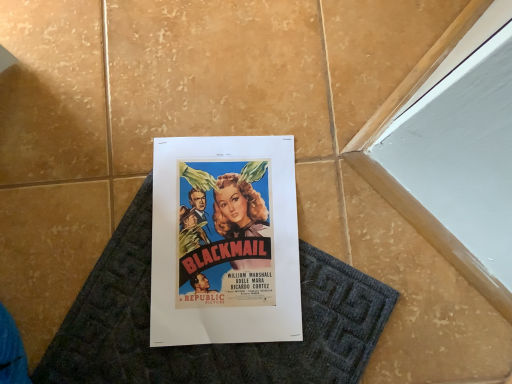
In order to face dark gray textured bath mat at center, should I rotate leftwards or rightwards?

A 1.414 degree turn to the left will do.

Describe the element at coordinates (210, 344) in the screenshot. I see `dark gray textured bath mat at center` at that location.

What are the coordinates of `dark gray textured bath mat at center` in the screenshot? It's located at (210, 344).

Identify the location of matte paper poster at center. This screenshot has width=512, height=384. (224, 241).

The image size is (512, 384). What do you see at coordinates (224, 241) in the screenshot?
I see `matte paper poster at center` at bounding box center [224, 241].

Where is `dark gray textured bath mat at center`? Image resolution: width=512 pixels, height=384 pixels. dark gray textured bath mat at center is located at coordinates (210, 344).

Considering the relative positions of matte paper poster at center and dark gray textured bath mat at center in the image provided, is matte paper poster at center to the left or to the right of dark gray textured bath mat at center?

matte paper poster at center is to the left of dark gray textured bath mat at center.

Is matte paper poster at center in front of dark gray textured bath mat at center?

No, it is not.

Which is in front, point (165, 170) or point (125, 380)?

The point (125, 380) is in front.

From the picture: From the image's perspective, would you say matte paper poster at center is shown under dark gray textured bath mat at center?

Actually, matte paper poster at center appears above dark gray textured bath mat at center in the image.

From a real-world perspective, is matte paper poster at center physically located above or below dark gray textured bath mat at center?

In terms of real-world spatial position, matte paper poster at center is above dark gray textured bath mat at center.

Between matte paper poster at center and dark gray textured bath mat at center, which one has larger width?

With larger width is matte paper poster at center.

Can you confirm if matte paper poster at center is shorter than dark gray textured bath mat at center?

No, matte paper poster at center is not shorter than dark gray textured bath mat at center.

Considering the sizes of matte paper poster at center and dark gray textured bath mat at center in the image, is matte paper poster at center bigger or smaller than dark gray textured bath mat at center?

Considering their sizes, matte paper poster at center takes up less space than dark gray textured bath mat at center.

Would you say matte paper poster at center is outside dark gray textured bath mat at center?

No.

Looking at this image, is matte paper poster at center placed right next to dark gray textured bath mat at center?

Yes, matte paper poster at center and dark gray textured bath mat at center clearly make contact.

Is matte paper poster at center facing towards dark gray textured bath mat at center?

Yes, matte paper poster at center is turned towards dark gray textured bath mat at center.

At what (x,y) coordinates should I click in order to perform the action: click on poster above the dark gray textured bath mat at center (from the image's perspective). Please return your answer as a coordinate pair (x, y). Image resolution: width=512 pixels, height=384 pixels. Looking at the image, I should click on (224, 241).

Which is more to the left, dark gray textured bath mat at center or matte paper poster at center?

matte paper poster at center is more to the left.

Which object is closer to the camera taking this photo, dark gray textured bath mat at center or matte paper poster at center?

dark gray textured bath mat at center is more forward.

Is point (54, 369) more distant than point (202, 207)?

No, (54, 369) is in front of (202, 207).

From the image's perspective, between dark gray textured bath mat at center and matte paper poster at center, who is located below?

dark gray textured bath mat at center, from the image's perspective.

From a real-world perspective, relative to matte paper poster at center, is dark gray textured bath mat at center vertically above or below?

Clearly, from a real-world perspective, dark gray textured bath mat at center is below matte paper poster at center.

Can you confirm if dark gray textured bath mat at center is thinner than matte paper poster at center?

Indeed, dark gray textured bath mat at center has a lesser width compared to matte paper poster at center.

Which of these two, dark gray textured bath mat at center or matte paper poster at center, stands shorter?

Standing shorter between the two is dark gray textured bath mat at center.

Which of these two, dark gray textured bath mat at center or matte paper poster at center, is bigger?

dark gray textured bath mat at center is bigger.

Is dark gray textured bath mat at center inside or outside of matte paper poster at center?

dark gray textured bath mat at center is enclosed within matte paper poster at center.

Consider the image. Are dark gray textured bath mat at center and matte paper poster at center making contact?

Yes, dark gray textured bath mat at center is touching matte paper poster at center.

Is matte paper poster at center at the back of dark gray textured bath mat at center?

Yes, dark gray textured bath mat at center is facing away from matte paper poster at center.

Measure the distance between dark gray textured bath mat at center and matte paper poster at center.

dark gray textured bath mat at center and matte paper poster at center are 2.52 inches apart from each other.

This screenshot has width=512, height=384. Identify the location of bath mat lying on the right of matte paper poster at center. (210, 344).

Find the location of a particular element. The width and height of the screenshot is (512, 384). bath mat lying below the matte paper poster at center (from the image's perspective) is located at coordinates (210, 344).

Locate an element on the screen. Image resolution: width=512 pixels, height=384 pixels. bath mat located on the right of matte paper poster at center is located at coordinates (210, 344).